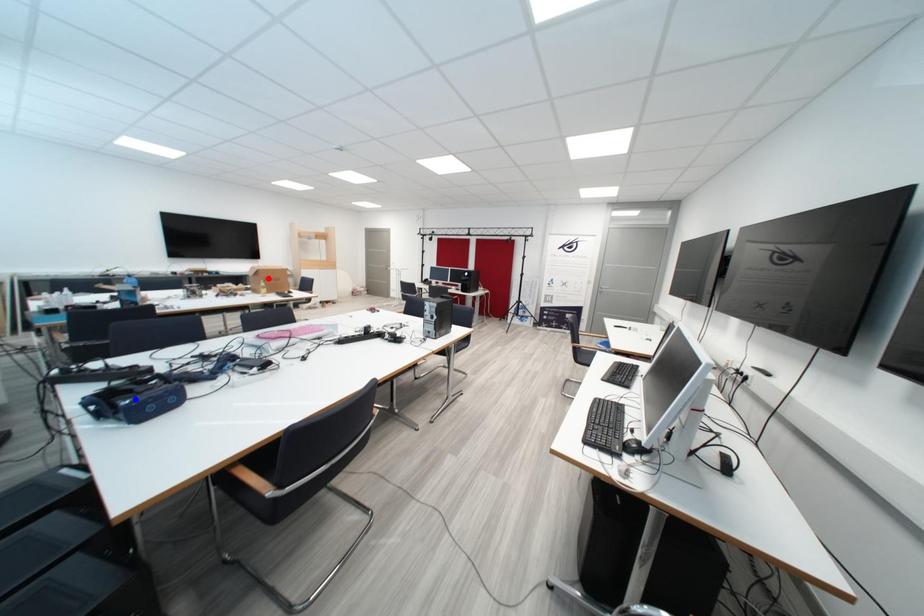
Question: In the image, two points are highlighted. Which point is nearer to the camera? Reply with the corresponding letter.

Choices:
 (A) blue point
 (B) red point

Answer: (A)